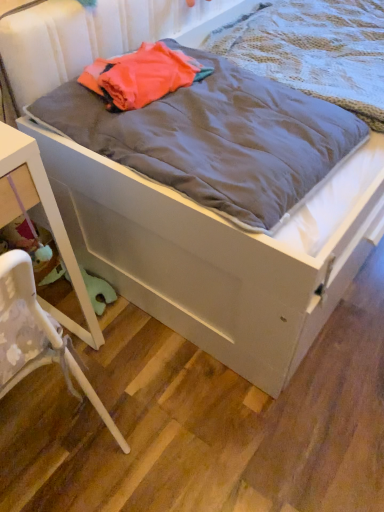
Identify the location of vacant area that is situated to the right of white glossy nightstand at lower left. Image resolution: width=384 pixels, height=512 pixels. (148, 382).